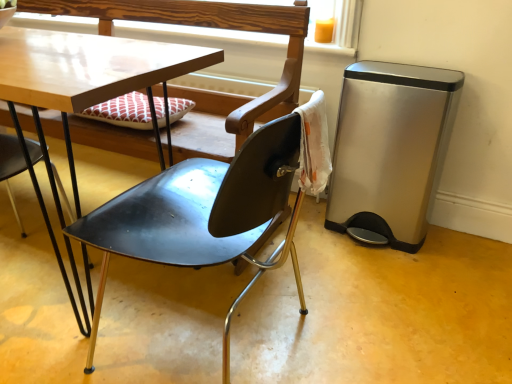
Where is `free space to the left of satin silver trash can at right`? This screenshot has height=384, width=512. free space to the left of satin silver trash can at right is located at coordinates (312, 232).